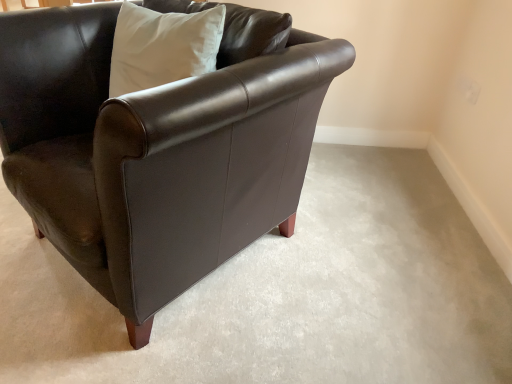
You are a GUI agent. You are given a task and a screenshot of the screen. Output one action in this format:
    pyautogui.click(x=<x>, y=<y>)
    Task: Click on the matte black leather chair at center
    
    Given the screenshot: What is the action you would take?
    pyautogui.click(x=156, y=150)

What is the approximate width of matte black leather chair at center?

The width of matte black leather chair at center is 1.06 meters.

Describe the element at coordinates (156, 150) in the screenshot. I see `matte black leather chair at center` at that location.

The width and height of the screenshot is (512, 384). I want to click on matte black leather chair at center, so click(156, 150).